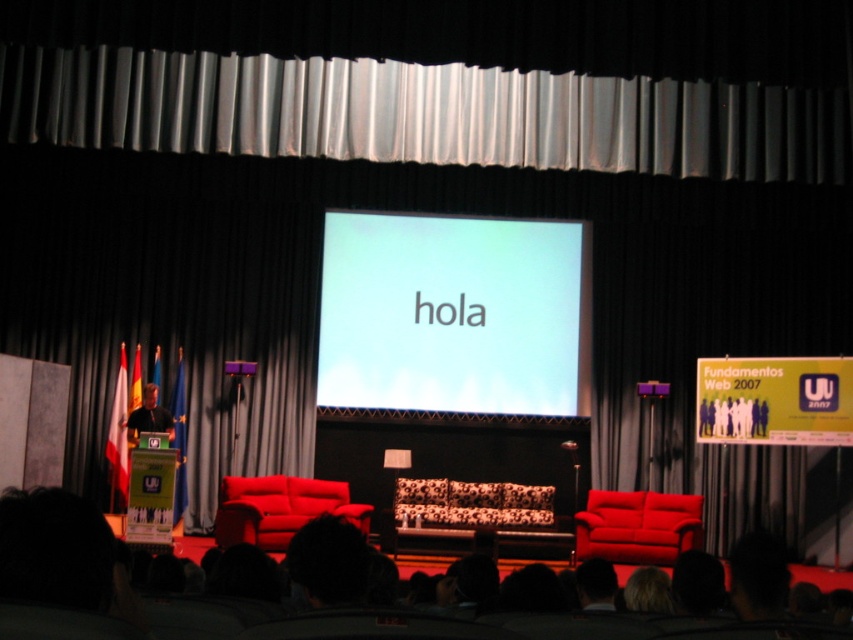
Question: Which point is farther to the camera?

Choices:
 (A) matte black podium at left
 (B) white glossy projection screen at center
 (C) dark hair at center

Answer: (B)

Question: Can you confirm if dark hair at center is positioned above matte black podium at left?

Choices:
 (A) yes
 (B) no

Answer: (A)

Question: Does dark hair at center have a greater width compared to matte black podium at left?

Choices:
 (A) no
 (B) yes

Answer: (B)

Question: Is white glossy projection screen at center to the right of matte black podium at left from the viewer's perspective?

Choices:
 (A) yes
 (B) no

Answer: (A)

Question: Which is nearer to the dark hair at center?

Choices:
 (A) matte black podium at left
 (B) white glossy projection screen at center

Answer: (A)

Question: Which of the following is the farthest from the observer?

Choices:
 (A) 155,429
 (B) 379,291

Answer: (B)